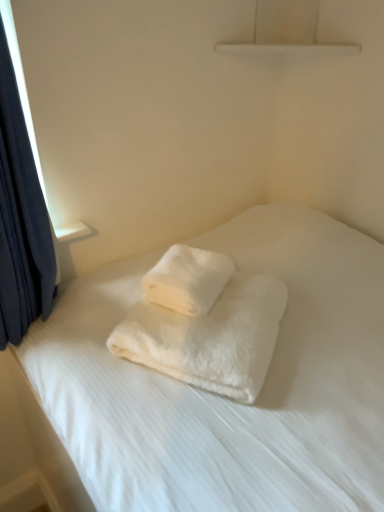
The width and height of the screenshot is (384, 512). I want to click on free space in front of white fluffy towel at center, which ranks as the 2th towel in bottom-to-top order, so click(204, 338).